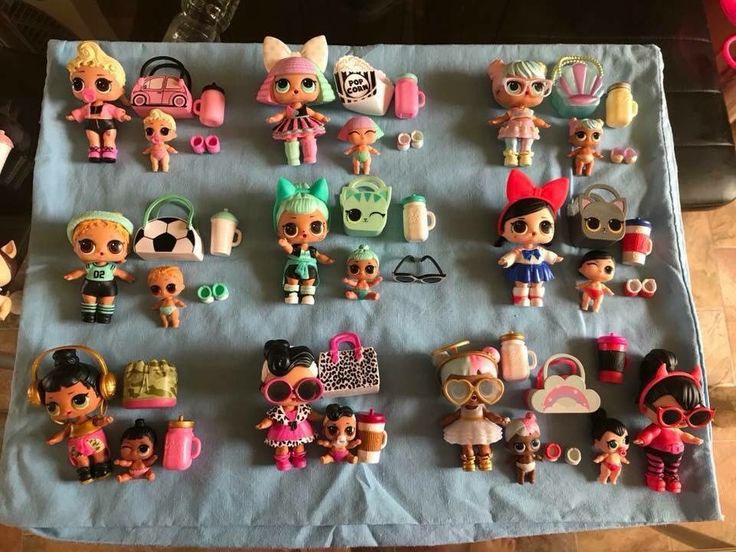
Find the location of a particular element. This screenshot has height=552, width=736. doll babies is located at coordinates (137, 442), (344, 416), (606, 436), (600, 265), (160, 286), (364, 269), (166, 129), (377, 128), (590, 130).